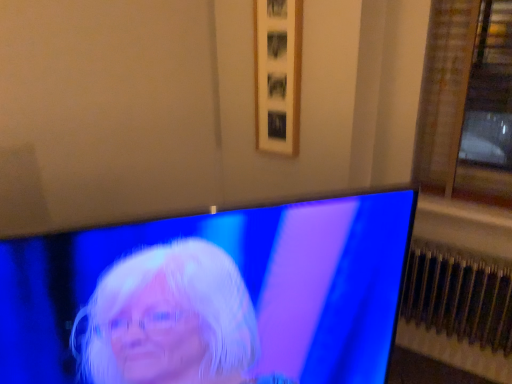
Image resolution: width=512 pixels, height=384 pixels. What are the coordinates of `metallic silver radiator at lower right` in the screenshot? It's located at (459, 296).

Locate an element on the screen. The height and width of the screenshot is (384, 512). wooden picture frame at upper center is located at coordinates (277, 74).

This screenshot has width=512, height=384. Find the location of `metallic silver radiator at lower right`. metallic silver radiator at lower right is located at coordinates (459, 296).

Is shiny blue screen at center to the right of wooden picture frame at upper center from the viewer's perspective?

No, shiny blue screen at center is not to the right of wooden picture frame at upper center.

Based on the photo, considering the positions of objects shiny blue screen at center and wooden picture frame at upper center in the image provided, who is in front, shiny blue screen at center or wooden picture frame at upper center?

shiny blue screen at center is more forward.

Is shiny blue screen at center looking in the opposite direction of wooden picture frame at upper center?

Yes, shiny blue screen at center is facing away from wooden picture frame at upper center.

Is metallic silver radiator at lower right outside of wooden picture frame at upper center?

metallic silver radiator at lower right lies outside wooden picture frame at upper center's area.

In terms of size, does metallic silver radiator at lower right appear bigger or smaller than wooden picture frame at upper center?

Considering their sizes, metallic silver radiator at lower right takes up more space than wooden picture frame at upper center.

Is there a large distance between metallic silver radiator at lower right and wooden picture frame at upper center?

No, there isn't a large distance between metallic silver radiator at lower right and wooden picture frame at upper center.

In order to click on radiator on the right of wooden picture frame at upper center in this screenshot , I will do `click(459, 296)`.

Considering the positions of point (331, 330) and point (442, 252), is point (331, 330) closer or farther from the camera than point (442, 252)?

Point (331, 330) is closer to the camera than point (442, 252).

Looking at their sizes, would you say shiny blue screen at center is wider or thinner than metallic silver radiator at lower right?

shiny blue screen at center is thinner than metallic silver radiator at lower right.

Considering the sizes of objects shiny blue screen at center and metallic silver radiator at lower right in the image provided, who is shorter, shiny blue screen at center or metallic silver radiator at lower right?

With less height is metallic silver radiator at lower right.

Consider the image. Is shiny blue screen at center aimed at metallic silver radiator at lower right?

No, shiny blue screen at center is not turned towards metallic silver radiator at lower right.

Which object is thinner, wooden picture frame at upper center or shiny blue screen at center?

wooden picture frame at upper center.

Consider the image. Considering the positions of objects wooden picture frame at upper center and shiny blue screen at center in the image provided, who is behind, wooden picture frame at upper center or shiny blue screen at center?

wooden picture frame at upper center is more distant.

Is wooden picture frame at upper center at the right side of shiny blue screen at center?

Yes.

Considering the relative sizes of metallic silver radiator at lower right and shiny blue screen at center in the image provided, is metallic silver radiator at lower right wider than shiny blue screen at center?

Yes.

How different are the orientations of metallic silver radiator at lower right and shiny blue screen at center in degrees?

They differ by 47.3 degrees in their facing directions.

Which of these two, metallic silver radiator at lower right or shiny blue screen at center, is smaller?

With smaller size is metallic silver radiator at lower right.

Considering the relative sizes of wooden picture frame at upper center and metallic silver radiator at lower right in the image provided, is wooden picture frame at upper center taller than metallic silver radiator at lower right?

Yes, wooden picture frame at upper center is taller than metallic silver radiator at lower right.

Does wooden picture frame at upper center have a larger size compared to metallic silver radiator at lower right?

Incorrect, wooden picture frame at upper center is not larger than metallic silver radiator at lower right.

Is wooden picture frame at upper center located outside metallic silver radiator at lower right?

Yes.

Find the location of `television located below the wooden picture frame at upper center (from the image's perspective)`. television located below the wooden picture frame at upper center (from the image's perspective) is located at coordinates (211, 296).

Image resolution: width=512 pixels, height=384 pixels. I want to click on picture frame above the metallic silver radiator at lower right (from a real-world perspective), so click(277, 74).

When comparing their distances from metallic silver radiator at lower right, does wooden picture frame at upper center or shiny blue screen at center seem further?

Based on the image, shiny blue screen at center appears to be further to metallic silver radiator at lower right.

When comparing their distances from shiny blue screen at center, does wooden picture frame at upper center or metallic silver radiator at lower right seem closer?

wooden picture frame at upper center is closer to shiny blue screen at center.

Which object lies nearer to the anchor point metallic silver radiator at lower right, shiny blue screen at center or wooden picture frame at upper center?

wooden picture frame at upper center lies closer to metallic silver radiator at lower right than the other object.

Based on their spatial positions, is metallic silver radiator at lower right or wooden picture frame at upper center further from shiny blue screen at center?

The object further to shiny blue screen at center is metallic silver radiator at lower right.

From the image, which object appears to be nearer to wooden picture frame at upper center, shiny blue screen at center or metallic silver radiator at lower right?

The object closer to wooden picture frame at upper center is metallic silver radiator at lower right.

Looking at the image, which one is located further to wooden picture frame at upper center, metallic silver radiator at lower right or shiny blue screen at center?

shiny blue screen at center.

This screenshot has height=384, width=512. What are the coordinates of `radiator positioned between shiny blue screen at center and wooden picture frame at upper center from near to far` in the screenshot? It's located at (459, 296).